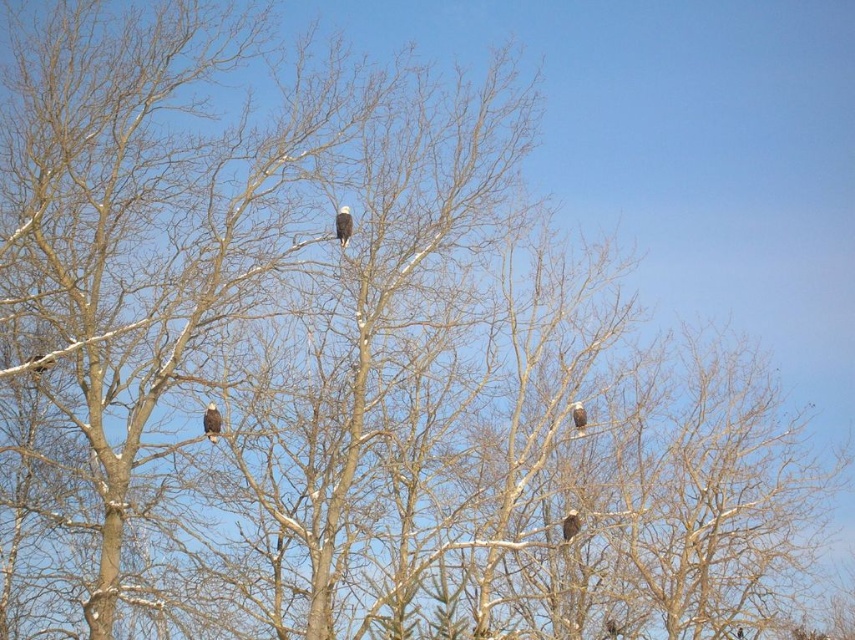
Who is shorter, white feathered eagle at upper center or white feathered eagle at center?

Standing shorter between the two is white feathered eagle at upper center.

Is point (211, 417) behind point (349, 216)?

No, (211, 417) is closer to viewer.

Identify the location of white feathered eagle at upper center. Image resolution: width=855 pixels, height=640 pixels. (211, 420).

Which of these two, white feathered eagle at upper center or white feathered crow at upper center, stands shorter?

white feathered crow at upper center

Looking at this image, can you confirm if white feathered eagle at upper center is positioned to the left of white feathered crow at upper center?

Correct, you'll find white feathered eagle at upper center to the left of white feathered crow at upper center.

The width and height of the screenshot is (855, 640). What do you see at coordinates (211, 420) in the screenshot? I see `white feathered eagle at upper center` at bounding box center [211, 420].

You are a GUI agent. You are given a task and a screenshot of the screen. Output one action in this format:
    pyautogui.click(x=<x>, y=<y>)
    Task: Click on the white feathered eagle at upper center
    This screenshot has width=855, height=640.
    Given the screenshot: What is the action you would take?
    pyautogui.click(x=211, y=420)

Who is more forward, (335, 228) or (572, 408)?

Point (335, 228) is more forward.

Can you confirm if white feathered eagle at center is bigger than white feathered crow at upper center?

Yes, white feathered eagle at center is bigger than white feathered crow at upper center.

What do you see at coordinates (343, 225) in the screenshot?
I see `white feathered eagle at center` at bounding box center [343, 225].

Image resolution: width=855 pixels, height=640 pixels. Identify the location of white feathered eagle at center. (343, 225).